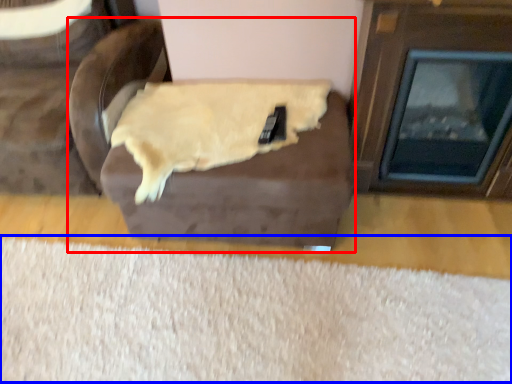
Question: Which of the following is the closest to the observer, furniture (highlighted by a red box) or mat (highlighted by a blue box)?

Choices:
 (A) furniture
 (B) mat

Answer: (B)